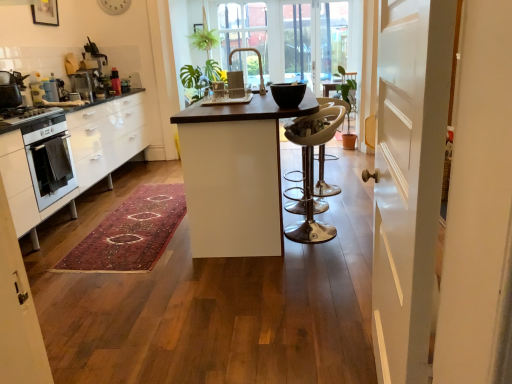
Find the location of `white glossy cabinets at left`. white glossy cabinets at left is located at coordinates (73, 155).

What do you see at coordinates (29, 118) in the screenshot? I see `white glossy stove at left` at bounding box center [29, 118].

Image resolution: width=512 pixels, height=384 pixels. Describe the element at coordinates (288, 94) in the screenshot. I see `black glossy bowl at center, which is the 1th appliance in bottom-to-top order` at that location.

Image resolution: width=512 pixels, height=384 pixels. Identify the location of white glossy oven at left. (49, 160).

From the picture: Measure the distance between white glossy oven at left and camera.

The depth of white glossy oven at left is 2.78 meters.

Locate an element on the screen. Image resolution: width=512 pixels, height=384 pixels. metallic silver coffee machine at left, which ranks as the second appliance in bottom-to-top order is located at coordinates [50, 91].

Identify the location of white glossy cabinets at left. The image size is (512, 384). (73, 155).

Who is shorter, white glossy table at center or metallic silver coffee machine at upper left, which is the first appliance in top-to-bottom order?

metallic silver coffee machine at upper left, which is the first appliance in top-to-bottom order.

Considering the points (236, 149) and (105, 96), which point is behind, point (236, 149) or point (105, 96)?

Point (105, 96)

Is white glossy table at center to the left of metallic silver coffee machine at upper left, the fourth appliance when ordered from front to back, from the viewer's perspective?

In fact, white glossy table at center is to the right of metallic silver coffee machine at upper left, the fourth appliance when ordered from front to back.

Between white glossy table at center and metallic silver coffee machine at upper left, the second appliance in the left-to-right sequence, which one has larger width?

white glossy table at center is wider.

Considering the relative sizes of white glossy cabinets at left and metallic silver coffee machine at left, the 3th appliance in the bottom-to-top sequence, in the image provided, is white glossy cabinets at left wider than metallic silver coffee machine at left, the 3th appliance in the bottom-to-top sequence,?

Indeed, white glossy cabinets at left has a greater width compared to metallic silver coffee machine at left, the 3th appliance in the bottom-to-top sequence.

Does white glossy cabinets at left touch metallic silver coffee machine at left, the 2th appliance positioned from the top?

They are not placed beside each other.

Based on their sizes in the image, would you say white glossy cabinets at left is bigger or smaller than metallic silver coffee machine at left, the 3th appliance in the bottom-to-top sequence?

In the image, white glossy cabinets at left appears to be larger than metallic silver coffee machine at left, the 3th appliance in the bottom-to-top sequence.

From the picture: Is white glossy cabinets at left oriented away from metallic silver coffee machine at left, placed as the 2th appliance when sorted from back to front?

No, metallic silver coffee machine at left, placed as the 2th appliance when sorted from back to front, is not at the back of white glossy cabinets at left.

Is point (54, 101) closer to camera compared to point (258, 143)?

No.

Considering the positions of objects metallic silver coffee machine at left, which is the 1th appliance in left-to-right order, and white glossy table at center in the image provided, who is behind, metallic silver coffee machine at left, which is the 1th appliance in left-to-right order, or white glossy table at center?

metallic silver coffee machine at left, which is the 1th appliance in left-to-right order, is further from the camera.

What's the angular difference between metallic silver coffee machine at left, the fourth appliance when ordered from right to left, and white glossy table at center's facing directions?

The facing directions of metallic silver coffee machine at left, the fourth appliance when ordered from right to left, and white glossy table at center are 1.65 degrees apart.

From a real-world perspective, is metallic silver coffee machine at left, which is the 1th appliance in left-to-right order, located higher than white glossy table at center?

Correct, in the physical world, metallic silver coffee machine at left, which is the 1th appliance in left-to-right order, is higher than white glossy table at center.

Does white matte door at center lie behind white glossy oven at left?

No, white matte door at center is in front of white glossy oven at left.

Is white matte door at center oriented towards white glossy oven at left?

No, white matte door at center is not aimed at white glossy oven at left.

Would you say white matte door at center is to the left or to the right of white glossy oven at left in the picture?

Clearly, white matte door at center is on the right of white glossy oven at left in the image.

Does white matte door at center have a smaller size compared to white glossy oven at left?

No, white matte door at center is not smaller than white glossy oven at left.

From a real-world perspective, is clear glass window at center on top of white matte door at center?

Indeed, from a real-world perspective, clear glass window at center stands above white matte door at center.

Considering the relative sizes of clear glass window at center and white matte door at center in the image provided, is clear glass window at center bigger than white matte door at center?

Yes.

Considering the relative sizes of clear glass window at center and white matte door at center in the image provided, is clear glass window at center wider than white matte door at center?

Yes.

From the image's perspective, which one is positioned lower, black glossy bowl at center, placed as the first appliance when sorted from right to left, or white glossy table at center?

white glossy table at center appears lower in the image.

Can you confirm if black glossy bowl at center, the 4th appliance positioned from the back, is smaller than white glossy table at center?

Yes.

From a real-world perspective, starting from the white glossy table at center, which appliance is the 2nd one vertically above it? Please provide its 2D coordinates.

[(288, 94)]

Is black glossy bowl at center, which is the 1th appliance in bottom-to-top order, inside or outside of white glossy table at center?

black glossy bowl at center, which is the 1th appliance in bottom-to-top order, is located beyond the bounds of white glossy table at center.

Considering the sizes of objects white glossy oven at left and clear glass window at center in the image provided, who is taller, white glossy oven at left or clear glass window at center?

clear glass window at center is taller.

Is white glossy oven at left facing away from clear glass window at center?

No, white glossy oven at left is not facing away from clear glass window at center.

Is the depth of white glossy oven at left less than that of clear glass window at center?

Yes, white glossy oven at left is closer to the viewer.

Locate an element on the screen. the 4th appliance above the white glossy table at center (from the image's perspective) is located at coordinates (90, 74).

This screenshot has width=512, height=384. What are the coordinates of `appliance that is the 3rd object located behind the white glossy cabinets at left` in the screenshot? It's located at (83, 84).

When comparing their distances from metallic silver coffee machine at upper left, which is the first appliance in top-to-bottom order, does white glossy stove at left or clear glass window at center seem closer?

Among the two, white glossy stove at left is located nearer to metallic silver coffee machine at upper left, which is the first appliance in top-to-bottom order.

Estimate the real-world distances between objects in this image. Which object is closer to black glossy bowl at center, the 4th appliance positioned from the back, white glossy oven at left or metallic silver coffee machine at left, which ranks as the third appliance in top-to-bottom order?

white glossy oven at left.

When comparing their distances from white glossy stove at left, does white matte door at center or metallic silver coffee machine at left, the second appliance from the right, seem closer?

Among the two, metallic silver coffee machine at left, the second appliance from the right, is located nearer to white glossy stove at left.

Which object lies further to the anchor point white matte door at center, white glossy table at center or metallic silver coffee machine at left, which ranks as the second appliance in bottom-to-top order?

metallic silver coffee machine at left, which ranks as the second appliance in bottom-to-top order, lies further to white matte door at center than the other object.

Based on their spatial positions, is white matte door at center or clear glass window at center closer to white glossy oven at left?

white matte door at center is positioned closer to the anchor white glossy oven at left.

Looking at the image, which one is located closer to black glossy bowl at center, the 4th appliance positioned from the back, metallic silver coffee machine at upper left, the 3th appliance when ordered from right to left, or white glossy stove at left?

white glossy stove at left.

Looking at the image, which one is located closer to white glossy cabinets at left, metallic silver coffee machine at left, which ranks as the second appliance in bottom-to-top order, or black glossy bowl at center, positioned as the first appliance in front-to-back order?

Based on the image, metallic silver coffee machine at left, which ranks as the second appliance in bottom-to-top order, appears to be nearer to white glossy cabinets at left.

From the image, which object appears to be farther from white glossy stove at left, metallic silver coffee machine at left, which is the 1th appliance in left-to-right order, or white glossy cabinets at left?

The object further to white glossy stove at left is metallic silver coffee machine at left, which is the 1th appliance in left-to-right order.

Find the location of a particular element. table between white matte door at center and metallic silver coffee machine at left, the fourth appliance when ordered from right to left, in the front-back direction is located at coordinates (234, 175).

Find the location of a particular element. oven between white matte door at center and metallic silver coffee machine at left, the second appliance from the right, in the front-back direction is located at coordinates (49, 160).

Find the location of `oven between white glossy stove at left and metallic silver coffee machine at left, placed as the 2th appliance when sorted from back to front, from front to back`. oven between white glossy stove at left and metallic silver coffee machine at left, placed as the 2th appliance when sorted from back to front, from front to back is located at coordinates (49, 160).

What are the coordinates of `table between white glossy cabinets at left and metallic silver coffee machine at left, the 3th appliance in the bottom-to-top sequence, along the z-axis` in the screenshot? It's located at (234, 175).